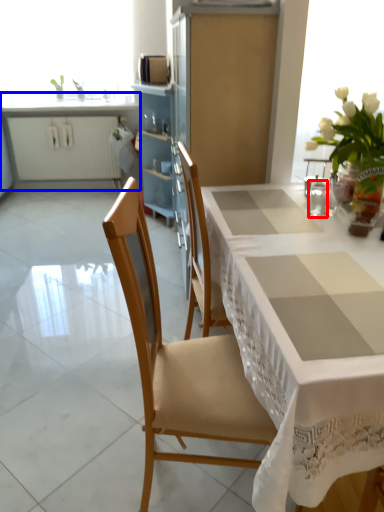
Question: Among these objects, which one is nearest to the camera, tableware (highlighted by a red box) or cabinetry (highlighted by a blue box)?

Choices:
 (A) tableware
 (B) cabinetry

Answer: (A)